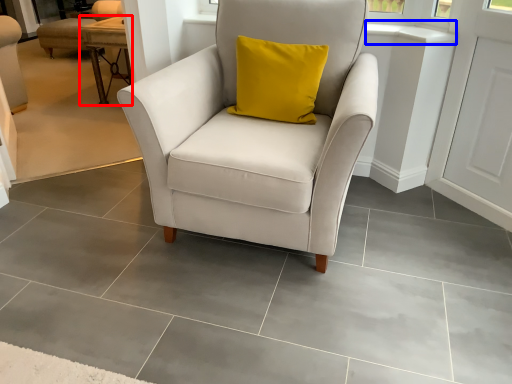
Question: Among these objects, which one is farthest to the camera, table (highlighted by a red box) or window sill (highlighted by a blue box)?

Choices:
 (A) table
 (B) window sill

Answer: (A)